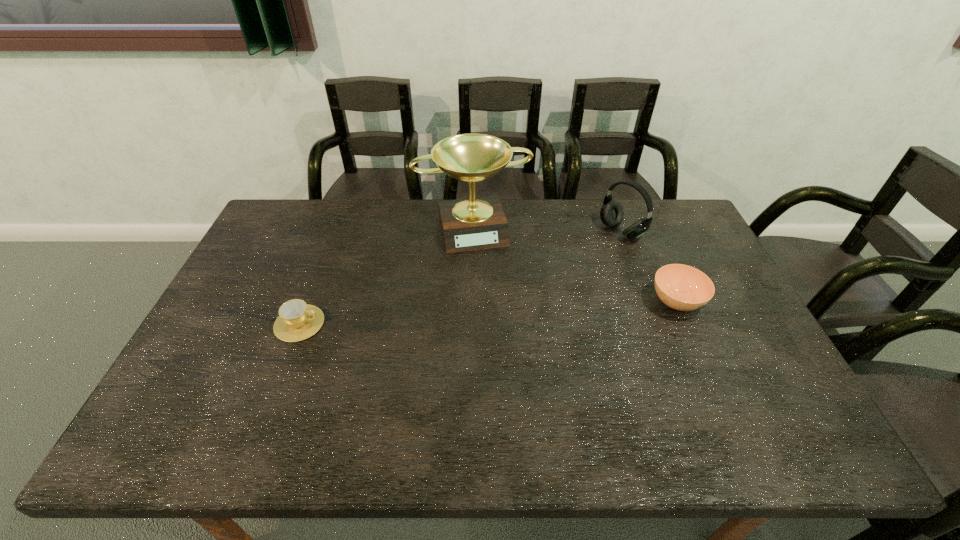
Image resolution: width=960 pixels, height=540 pixels. Find the location of `the shortest object`. the shortest object is located at coordinates (297, 321).

Locate an element on the screen. the leftmost object is located at coordinates (297, 321).

Identify the location of the second shortest object. (681, 287).

Locate an element on the screen. award is located at coordinates coord(475,223).

The width and height of the screenshot is (960, 540). In order to click on the tallest object in this screenshot , I will do `click(475, 223)`.

Identify the location of headset. The width and height of the screenshot is (960, 540). (611, 213).

You are a GUI agent. You are given a task and a screenshot of the screen. Output one action in this format:
    pyautogui.click(x=<x>, y=<y>)
    Task: Click on the free space located 0.120m with the handle on the side of the leftmost object
    
    Given the screenshot: What is the action you would take?
    pyautogui.click(x=367, y=323)

Locate an element on the screen. The height and width of the screenshot is (540, 960). vacant space located on the front of the third tallest object is located at coordinates (719, 400).

Image resolution: width=960 pixels, height=540 pixels. Identify the location of vacant region located on the front-facing side of the second object from left to right. (504, 328).

Image resolution: width=960 pixels, height=540 pixels. I want to click on vacant space situated 0.190m on the front-facing side of the second object from left to right, so click(494, 295).